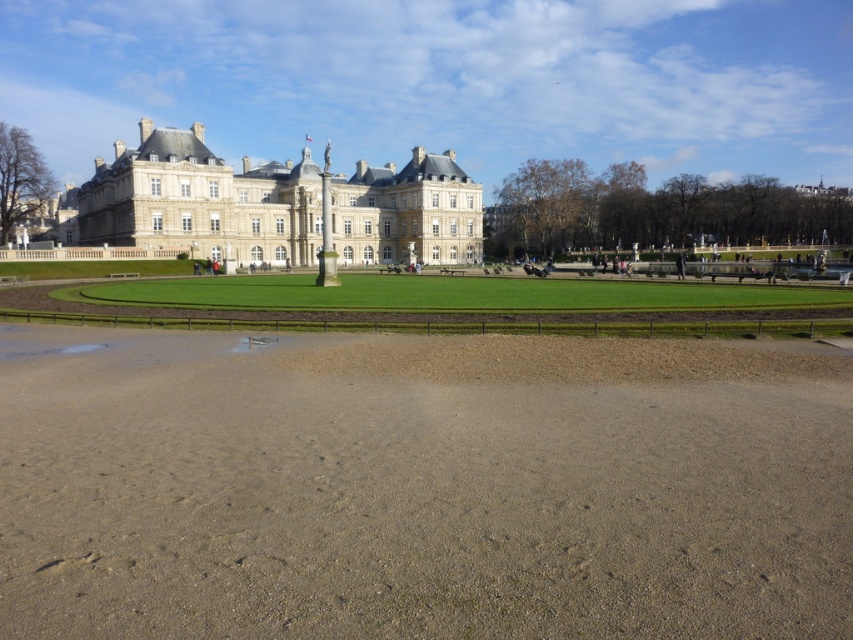
You are standing in front of the historic building and want to take a photo. You notice two points marked in the scene. Which point, point (723, 515) or point (408, 186), is closer to your current position?

Point (723, 515) is closer to the camera than point (408, 186), so it is closer to your current position.